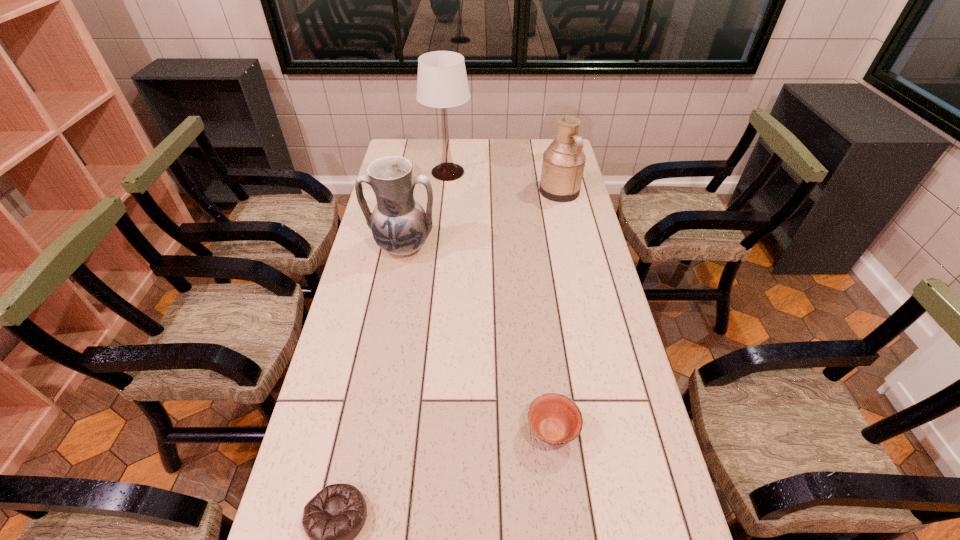
Locate an element on the screen. free space between the fourth farthest object and the tallest object is located at coordinates (500, 301).

At what (x,y) coordinates should I click in order to perform the action: click on vacant space in between the table lamp and the bowl. Please return your answer as a coordinate pair (x, y). Looking at the image, I should click on (500, 301).

Image resolution: width=960 pixels, height=540 pixels. In order to click on object that ranks as the closest to the tallest object in this screenshot , I will do `click(563, 163)`.

Select which object appears as the fourth closest to the left pitcher. Please provide its 2D coordinates. Your answer should be formatted as a tuple, i.e. [(x, y)], where the tuple contains the x and y coordinates of a point satisfying the conditions above.

[(332, 519)]

Where is `vacant space that satisfies the following two spatial constraints: 1. above the cylindrical shade of the farther pitcher; 2. on the left side of the tallest object`? This screenshot has height=540, width=960. vacant space that satisfies the following two spatial constraints: 1. above the cylindrical shade of the farther pitcher; 2. on the left side of the tallest object is located at coordinates (445, 191).

Locate an element on the screen. free spot that satisfies the following two spatial constraints: 1. on the front-facing side of the left pitcher; 2. on the left side of the fourth object from left to right is located at coordinates (369, 430).